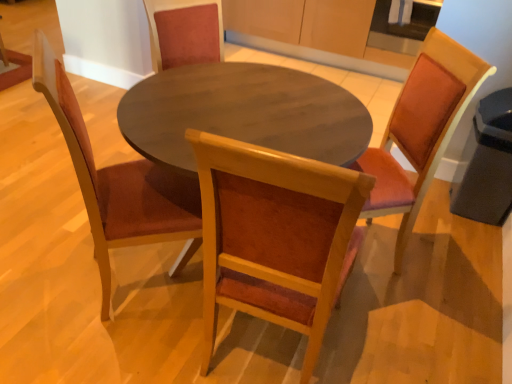
This screenshot has height=384, width=512. I want to click on wooden chair at right, marked as the first chair in a right-to-left arrangement, so click(421, 130).

Between wooden chair at right, the third chair viewed from the left, and wooden chair at center, marked as the second chair in a right-to-left arrangement, which one has larger size?

wooden chair at center, marked as the second chair in a right-to-left arrangement.

Is wooden chair at right, the third chair viewed from the left, not near wooden chair at center, the 2th chair from the left?

No, wooden chair at right, the third chair viewed from the left, is not far away from wooden chair at center, the 2th chair from the left.

Is point (412, 196) closer or farther from the camera than point (239, 217)?

Point (412, 196) appears to be farther away from the viewer than point (239, 217).

Does wooden chair at right, the third chair viewed from the left, appear on the left side of wooden chair at center, the 2th chair from the left?

No.

Is wooden chair at center, marked as the second chair in a right-to-left arrangement, spatially inside wooden chair at left, arranged as the third chair when viewed from the right, or outside of it?

wooden chair at center, marked as the second chair in a right-to-left arrangement, cannot be found inside wooden chair at left, arranged as the third chair when viewed from the right.

Does wooden chair at center, marked as the second chair in a right-to-left arrangement, have a greater height compared to wooden chair at left, arranged as the third chair when viewed from the right?

No.

From a real-world perspective, is wooden chair at center, the 2th chair from the left, located higher than wooden chair at left, arranged as the third chair when viewed from the right?

Indeed, from a real-world perspective, wooden chair at center, the 2th chair from the left, stands above wooden chair at left, arranged as the third chair when viewed from the right.

Is point (276, 310) closer to viewer compared to point (129, 209)?

Yes, point (276, 310) is closer to viewer.

From the picture: From the image's perspective, which one is positioned higher, wooden chair at right, marked as the first chair in a right-to-left arrangement, or wooden chair at left, arranged as the third chair when viewed from the right?

wooden chair at right, marked as the first chair in a right-to-left arrangement, appears higher in the image.

Considering the sizes of wooden chair at right, marked as the first chair in a right-to-left arrangement, and wooden chair at left, which is the 1th chair in left-to-right order, in the image, is wooden chair at right, marked as the first chair in a right-to-left arrangement, wider or thinner than wooden chair at left, which is the 1th chair in left-to-right order,?

In the image, wooden chair at right, marked as the first chair in a right-to-left arrangement, appears to be more narrow than wooden chair at left, which is the 1th chair in left-to-right order.

Who is smaller, wooden chair at right, the third chair viewed from the left, or wooden chair at left, which is the 1th chair in left-to-right order?

wooden chair at right, the third chair viewed from the left.

Could you tell me if wooden chair at right, marked as the first chair in a right-to-left arrangement, is turned towards wooden chair at left, which is the 1th chair in left-to-right order?

Yes, wooden chair at right, marked as the first chair in a right-to-left arrangement, is turned towards wooden chair at left, which is the 1th chair in left-to-right order.

Who is shorter, wooden chair at left, which is the 1th chair in left-to-right order, or wooden chair at right, the third chair viewed from the left?

Standing shorter between the two is wooden chair at right, the third chair viewed from the left.

Considering the sizes of objects wooden chair at left, arranged as the third chair when viewed from the right, and wooden chair at right, the third chair viewed from the left, in the image provided, who is bigger, wooden chair at left, arranged as the third chair when viewed from the right, or wooden chair at right, the third chair viewed from the left,?

Bigger between the two is wooden chair at left, arranged as the third chair when viewed from the right.

Which is behind, point (172, 175) or point (458, 85)?

The point (172, 175) is behind.

From the image's perspective, is wooden chair at left, arranged as the third chair when viewed from the right, under wooden chair at right, the third chair viewed from the left?

Correct, wooden chair at left, arranged as the third chair when viewed from the right, appears lower than wooden chair at right, the third chair viewed from the left, in the image.

From the image's perspective, which one is positioned lower, wooden chair at center, marked as the second chair in a right-to-left arrangement, or wooden chair at right, marked as the first chair in a right-to-left arrangement?

wooden chair at center, marked as the second chair in a right-to-left arrangement.

From a real-world perspective, which is physically below, wooden chair at center, marked as the second chair in a right-to-left arrangement, or wooden chair at right, marked as the first chair in a right-to-left arrangement?

wooden chair at right, marked as the first chair in a right-to-left arrangement, from a real-world perspective.

Looking at the image, does wooden chair at center, the 2th chair from the left, seem bigger or smaller compared to wooden chair at right, marked as the first chair in a right-to-left arrangement?

In the image, wooden chair at center, the 2th chair from the left, appears to be larger than wooden chair at right, marked as the first chair in a right-to-left arrangement.

From a real-world perspective, does wooden chair at left, which is the 1th chair in left-to-right order, sit lower than wooden chair at center, marked as the second chair in a right-to-left arrangement?

Yes, from a real-world perspective, wooden chair at left, which is the 1th chair in left-to-right order, is under wooden chair at center, marked as the second chair in a right-to-left arrangement.

Can you confirm if wooden chair at left, which is the 1th chair in left-to-right order, is wider than wooden chair at center, the 2th chair from the left?

Yes.

From the image's perspective, is wooden chair at left, which is the 1th chair in left-to-right order, located above or below wooden chair at center, marked as the second chair in a right-to-left arrangement?

Based on their image positions, wooden chair at left, which is the 1th chair in left-to-right order, is located above wooden chair at center, marked as the second chair in a right-to-left arrangement.

What's the angular difference between wooden chair at left, which is the 1th chair in left-to-right order, and wooden chair at center, marked as the second chair in a right-to-left arrangement,'s facing directions?

46.4 degrees.

Starting from the wooden chair at right, marked as the first chair in a right-to-left arrangement, which chair is the 2nd one in front? Please provide its 2D coordinates.

[(275, 236)]

From a real-world perspective, which chair is the 1st one underneath the wooden chair at center, marked as the second chair in a right-to-left arrangement? Please provide its 2D coordinates.

[(117, 182)]

Estimate the real-world distances between objects in this image. Which object is closer to wooden chair at left, which is the 1th chair in left-to-right order, wooden chair at right, marked as the first chair in a right-to-left arrangement, or wooden chair at center, the 2th chair from the left?

Based on the image, wooden chair at center, the 2th chair from the left, appears to be nearer to wooden chair at left, which is the 1th chair in left-to-right order.

From the image, which object appears to be farther from wooden chair at center, marked as the second chair in a right-to-left arrangement, wooden chair at right, marked as the first chair in a right-to-left arrangement, or wooden chair at left, arranged as the third chair when viewed from the right?

wooden chair at right, marked as the first chair in a right-to-left arrangement.

From the image, which object appears to be farther from wooden chair at center, the 2th chair from the left, wooden chair at left, arranged as the third chair when viewed from the right, or wooden chair at right, the third chair viewed from the left?

wooden chair at right, the third chair viewed from the left, is further to wooden chair at center, the 2th chair from the left.

Considering their positions, is wooden chair at left, which is the 1th chair in left-to-right order, positioned closer to wooden chair at right, marked as the first chair in a right-to-left arrangement, than wooden chair at center, the 2th chair from the left?

The object closer to wooden chair at right, marked as the first chair in a right-to-left arrangement, is wooden chair at center, the 2th chair from the left.

Based on their spatial positions, is wooden chair at center, marked as the second chair in a right-to-left arrangement, or wooden chair at left, arranged as the third chair when viewed from the right, further from wooden chair at right, marked as the first chair in a right-to-left arrangement?

Among the two, wooden chair at left, arranged as the third chair when viewed from the right, is located further to wooden chair at right, marked as the first chair in a right-to-left arrangement.

Looking at the image, which one is located further to wooden chair at left, arranged as the third chair when viewed from the right, wooden chair at center, marked as the second chair in a right-to-left arrangement, or wooden chair at right, the third chair viewed from the left?

wooden chair at right, the third chair viewed from the left.

The height and width of the screenshot is (384, 512). I want to click on chair between wooden chair at left, which is the 1th chair in left-to-right order, and wooden chair at right, the third chair viewed from the left, in the horizontal direction, so (x=275, y=236).